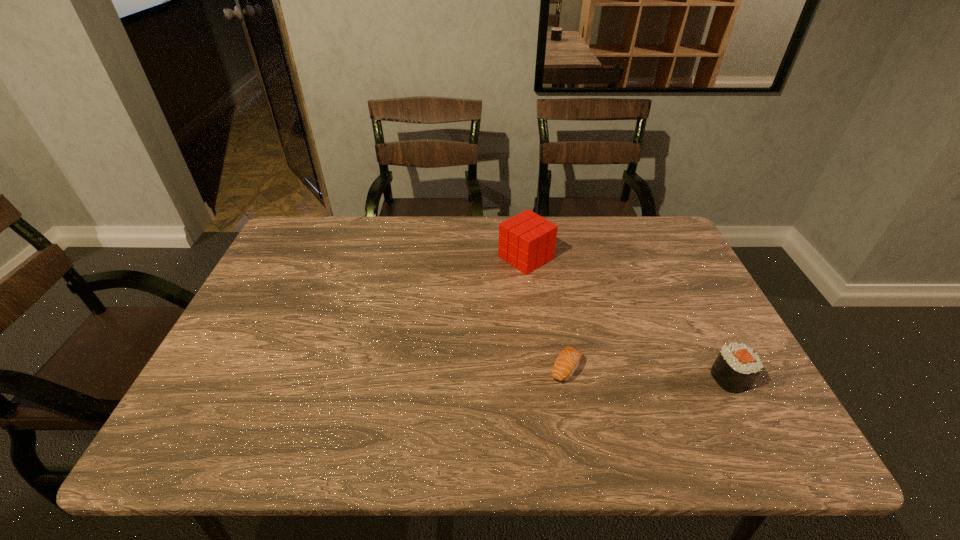
Image resolution: width=960 pixels, height=540 pixels. What are the coordinates of `empty space between the rightmost object and the left sushi` in the screenshot? It's located at (648, 373).

Where is `empty space that is in between the tallest object and the taller sushi`? This screenshot has height=540, width=960. empty space that is in between the tallest object and the taller sushi is located at coordinates (628, 318).

You are a GUI agent. You are given a task and a screenshot of the screen. Output one action in this format:
    pyautogui.click(x=<x>, y=<y>)
    Task: Click on the vacant space that's between the farthest object and the shorter sushi
    
    Given the screenshot: What is the action you would take?
    pyautogui.click(x=545, y=313)

This screenshot has height=540, width=960. I want to click on free spot between the farthest object and the shortest object, so click(545, 313).

Locate an element on the screen. This screenshot has width=960, height=540. empty space that is in between the shorter sushi and the right sushi is located at coordinates (648, 373).

This screenshot has width=960, height=540. I want to click on free point between the left sushi and the tallest object, so click(545, 313).

What are the coordinates of `the second closest object to the tallest object` in the screenshot? It's located at (737, 366).

Locate which object is the closest to the tallest object. Please provide its 2D coordinates. Your answer should be formatted as a tuple, i.e. [(x, y)], where the tuple contains the x and y coordinates of a point satisfying the conditions above.

[(567, 361)]

At what (x,y) coordinates should I click in order to perform the action: click on vacant space that satisfies the following two spatial constraints: 1. on the front side of the left sushi; 2. on the left side of the right sushi. Please return your answer as a coordinate pair (x, y). The height and width of the screenshot is (540, 960). Looking at the image, I should click on (566, 378).

Where is `free spot that satisfies the following two spatial constraints: 1. on the front side of the farthest object; 2. on the left side of the rightmost object`? free spot that satisfies the following two spatial constraints: 1. on the front side of the farthest object; 2. on the left side of the rightmost object is located at coordinates (540, 378).